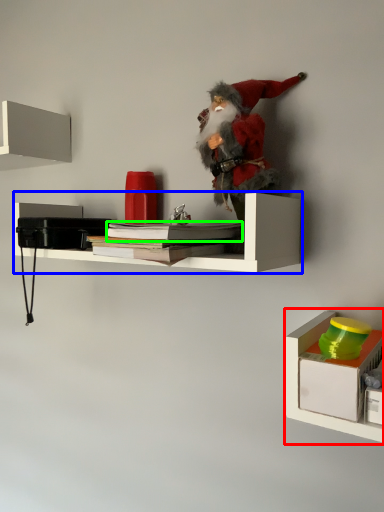
Question: Which is farther away from shelf (highlighted by a red box)? shelf (highlighted by a blue box) or book (highlighted by a green box)?

Choices:
 (A) shelf
 (B) book

Answer: (A)